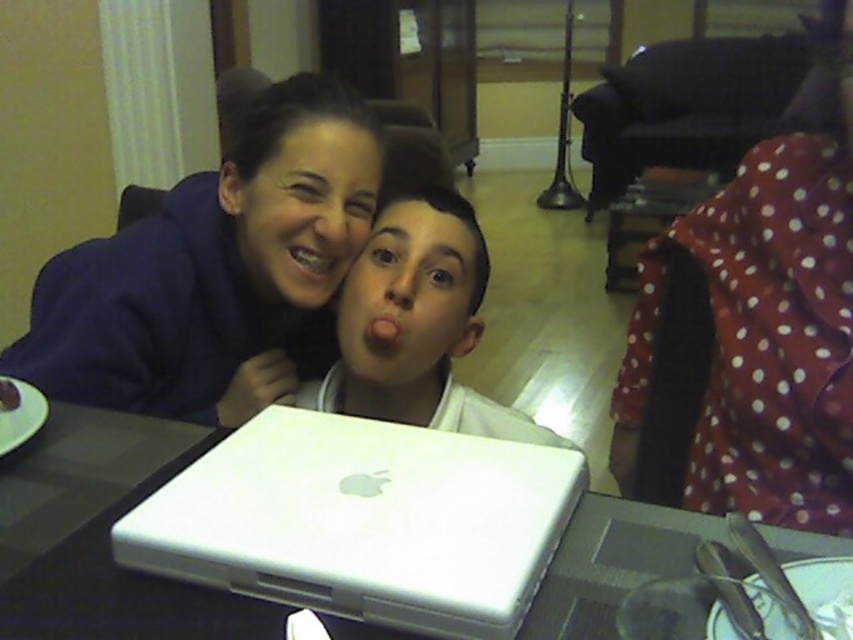
Question: Does matte blue hoodie at upper left appear on the right side of matte black laptop at center?

Choices:
 (A) yes
 (B) no

Answer: (B)

Question: Is metallic braces at center further to camera compared to matte white mouth at center?

Choices:
 (A) no
 (B) yes

Answer: (B)

Question: Among these points, which one is nearest to the camera?

Choices:
 (A) (248, 392)
 (B) (289, 252)
 (C) (378, 339)
 (D) (399, 211)

Answer: (C)

Question: Can you confirm if white plastic laptop at center is smaller than matte white mouth at center?

Choices:
 (A) yes
 (B) no

Answer: (B)

Question: Which object is closer to the camera taking this photo?

Choices:
 (A) matte black face at upper center
 (B) matte white mouth at center
 (C) white plastic laptop at center

Answer: (C)

Question: Which point is farther to the camera?

Choices:
 (A) (379, 348)
 (B) (146, 509)
 (C) (291, 99)
 (D) (291, 259)

Answer: (D)